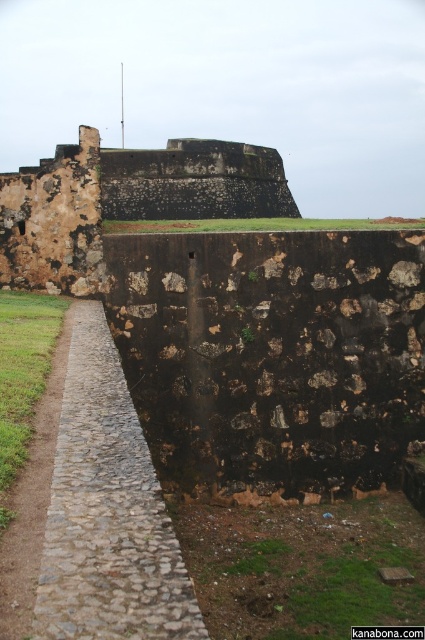
You are a tourist standing at the entrance of the fortification and want to take a photo of the rusty stone wall at center. The gray cobblestone path at center is in your way. Can you walk around the path to get a clear view of the wall?

The gray cobblestone path at center is in front of the rusty stone wall at center, so you cannot walk around the path to get a clear view of the wall. You need to move past the path towards the wall to capture it in your photo.

You are standing at the point closer to the wall in the image. There are two points marked on the cobblestone pathway in front of you. One is labeled as point (181,636) and the other is point (136,152). Which point is farther away from your current position?

Point (136,152) is farther away from your current position because you are standing at the point closer to the wall, and point (136,152) is behind point (181,636) relative to the wall.